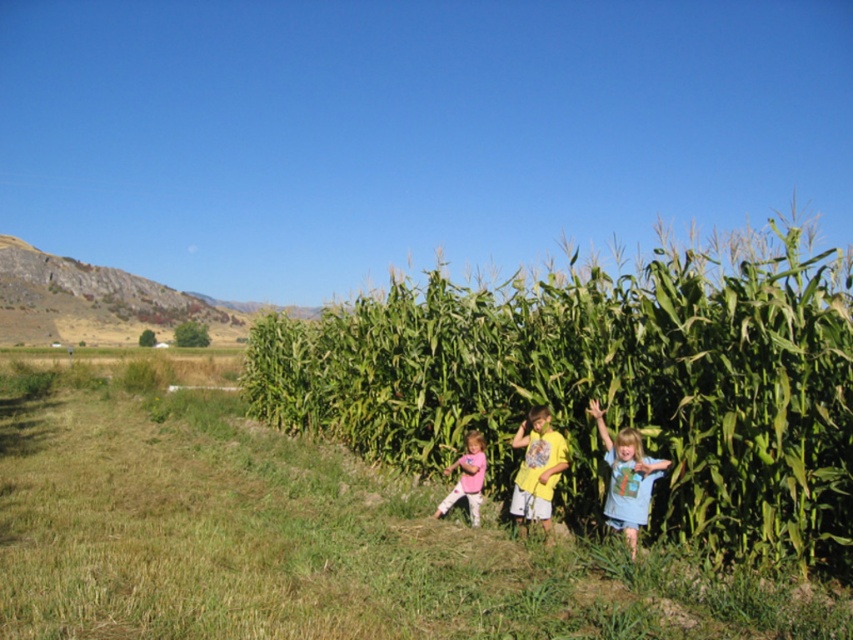
You are a photographer taking a picture of the green leafy corn at center and the blue cotton shirt at right. Which object will appear larger in the photo?

The green leafy corn at center will appear larger in the photo because it is bigger than the blue cotton shirt at right.

You are a photographer standing in the cornfield and want to take a photo of the green leafy corn at center and the blue cotton shirt at right. If your camera has a maximum focus range of 10 feet, will both subjects be in focus?

The distance between the green leafy corn at center and the blue cotton shirt at right is 9.02 feet, which is within the camera maximum focus range of 10 feet. Therefore, both subjects will be in focus.

You are a photographer trying to capture a photo of the green grass at lower center and the pink fabric shirt at lower center. Based on their heights, which object should you focus on first if you want to ensure both are in focus without adjusting the camera settings?

The green grass at lower center is shorter than the pink fabric shirt at lower center. To ensure both are in focus, you should focus on the pink fabric shirt at lower center first since it is taller and will require the camera to adjust to a greater depth of field.